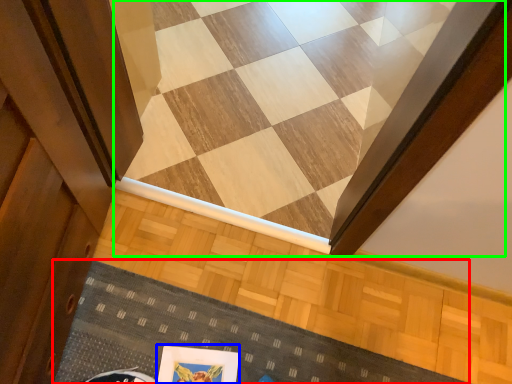
Question: Which object is the farthest from doormat (highlighted by a red box)? Choose among these: picture frame (highlighted by a blue box) or stairwell (highlighted by a green box).

Choices:
 (A) picture frame
 (B) stairwell

Answer: (B)